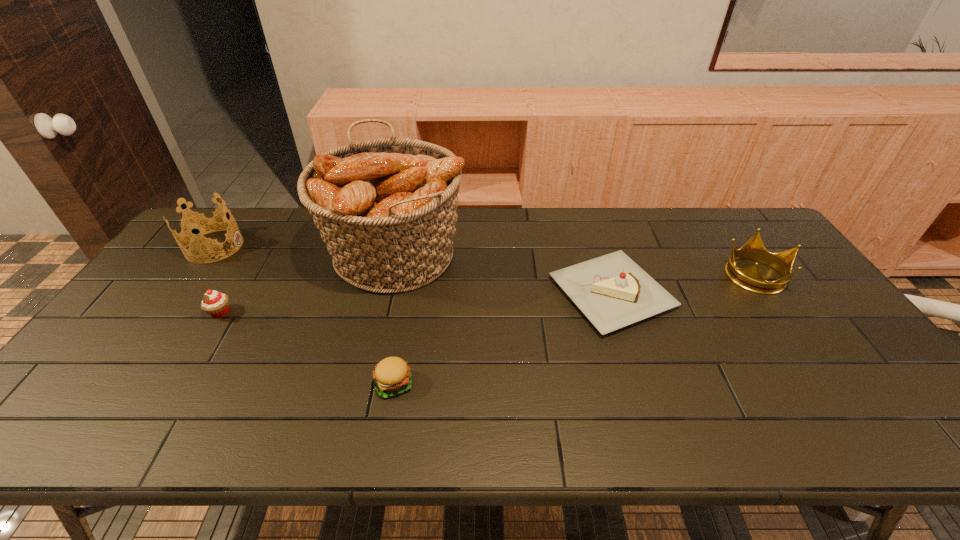
Locate an element on the screen. This screenshot has width=960, height=540. vacant space situated on the front of the second tallest object is located at coordinates (139, 350).

The image size is (960, 540). I want to click on blank area located on the right of the shorter crown, so click(x=803, y=274).

Locate an element on the screen. The width and height of the screenshot is (960, 540). vacant area situated on the front of the cupcake is located at coordinates click(161, 411).

Where is `vacant space located 0.130m on the back of the fifth object from left to right`? vacant space located 0.130m on the back of the fifth object from left to right is located at coordinates (591, 231).

At what (x,y) coordinates should I click in order to perform the action: click on vacant space situated 0.170m on the right of the shortest object. Please return your answer as a coordinate pair (x, y). This screenshot has height=540, width=960. Looking at the image, I should click on (485, 383).

Find the location of a particular element. This screenshot has height=540, width=960. basket that is at the far edge is located at coordinates (386, 208).

Identify the location of crown that is at the far edge. This screenshot has height=540, width=960. (203, 225).

The height and width of the screenshot is (540, 960). I want to click on object that is at the left edge, so click(x=203, y=225).

Image resolution: width=960 pixels, height=540 pixels. Find the location of `object at the right edge`. object at the right edge is located at coordinates (749, 278).

You are a GUI agent. You are given a task and a screenshot of the screen. Output one action in this format:
    pyautogui.click(x=<x>, y=<y>)
    Task: Click on the object positioned at the far left corner
    This screenshot has width=960, height=540.
    Given the screenshot: What is the action you would take?
    pyautogui.click(x=203, y=225)